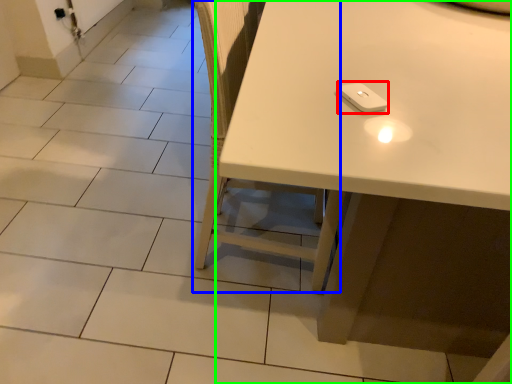
Question: Considering the real-world distances, which object is closest to Wii controller (highlighted by a red box)? chair (highlighted by a blue box) or table (highlighted by a green box).

Choices:
 (A) chair
 (B) table

Answer: (B)